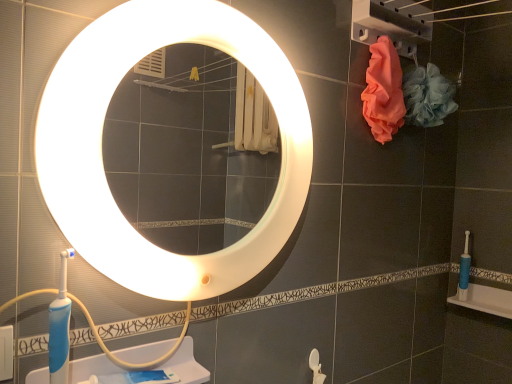
Question: From the image's perspective, is pink fabric at upper right beneath white plastic sink at lower left?

Choices:
 (A) yes
 (B) no

Answer: (B)

Question: Is white plastic sink at lower left at the back of pink fabric at upper right?

Choices:
 (A) yes
 (B) no

Answer: (B)

Question: From a real-world perspective, is pink fabric at upper right positioned under white plastic sink at lower left based on gravity?

Choices:
 (A) no
 (B) yes

Answer: (A)

Question: Can you confirm if pink fabric at upper right is smaller than white plastic sink at lower left?

Choices:
 (A) no
 (B) yes

Answer: (A)

Question: Is pink fabric at upper right not inside white plastic sink at lower left?

Choices:
 (A) no
 (B) yes

Answer: (B)

Question: Considering their positions, is blue plastic toothbrush at lower right located in front of or behind pink fabric at upper right?

Choices:
 (A) front
 (B) behind

Answer: (B)

Question: From their relative heights in the image, would you say blue plastic toothbrush at lower right is taller or shorter than pink fabric at upper right?

Choices:
 (A) tall
 (B) short

Answer: (B)

Question: Based on their sizes in the image, would you say blue plastic toothbrush at lower right is bigger or smaller than pink fabric at upper right?

Choices:
 (A) small
 (B) big

Answer: (A)

Question: Does point (461, 261) appear closer or farther from the camera than point (377, 36)?

Choices:
 (A) closer
 (B) farther

Answer: (B)

Question: Considering their positions, is blue plastic toothbrush at lower right located in front of or behind white glossy mirror at upper center?

Choices:
 (A) behind
 (B) front

Answer: (A)

Question: From the image's perspective, relative to white glossy mirror at upper center, is blue plastic toothbrush at lower right above or below?

Choices:
 (A) above
 (B) below

Answer: (B)

Question: From a real-world perspective, is blue plastic toothbrush at lower right positioned above or below white glossy mirror at upper center?

Choices:
 (A) below
 (B) above

Answer: (A)

Question: Is blue plastic toothbrush at lower right wider or thinner than white glossy mirror at upper center?

Choices:
 (A) wide
 (B) thin

Answer: (A)

Question: From a real-world perspective, is white plastic sink at lower left above or below pink fabric at upper right?

Choices:
 (A) above
 (B) below

Answer: (B)

Question: In terms of width, does white plastic sink at lower left look wider or thinner when compared to pink fabric at upper right?

Choices:
 (A) thin
 (B) wide

Answer: (B)